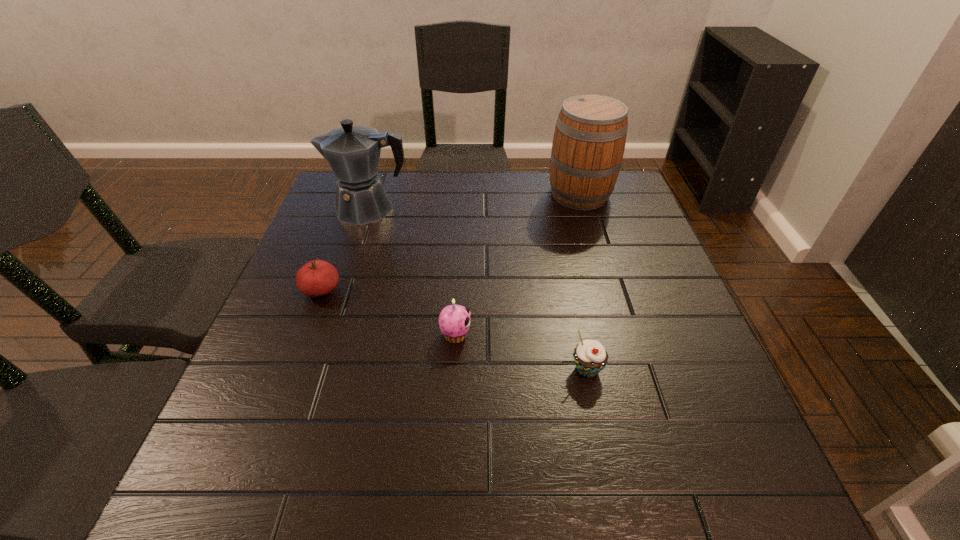
I want to click on cider, so click(589, 140).

I want to click on coffeepot, so click(353, 152).

You are a GUI agent. You are given a task and a screenshot of the screen. Output one action in this format:
    pyautogui.click(x=<x>, y=<y>)
    Task: Click on the farther cupcake
    This screenshot has width=960, height=540.
    Given the screenshot: What is the action you would take?
    pyautogui.click(x=454, y=320)

The image size is (960, 540). Find the location of `the left cupcake`. the left cupcake is located at coordinates (454, 320).

At what (x,y) coordinates should I click in order to perform the action: click on the nearest object. Please return your answer as a coordinate pair (x, y). The width and height of the screenshot is (960, 540). Looking at the image, I should click on (590, 356).

You are a GUI agent. You are given a task and a screenshot of the screen. Output one action in this format:
    pyautogui.click(x=<x>, y=<y>)
    Task: Click on the right cupcake
    
    Given the screenshot: What is the action you would take?
    [590, 356]

The width and height of the screenshot is (960, 540). Identify the location of tomato. (316, 278).

I want to click on free space located on the left of the cider, so click(460, 194).

This screenshot has width=960, height=540. I want to click on vacant space situated 0.260m on the face of the farther cupcake, so click(x=595, y=335).

Locate an element on the screen. vacant space located 0.090m on the left of the right cupcake is located at coordinates (523, 369).